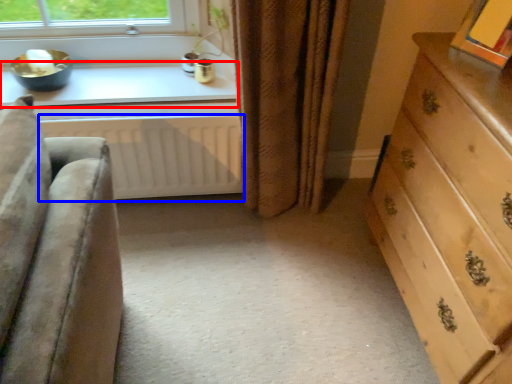
Question: Which of the following is the closest to the observer, window sill (highlighted by a red box) or radiator (highlighted by a blue box)?

Choices:
 (A) window sill
 (B) radiator

Answer: (B)